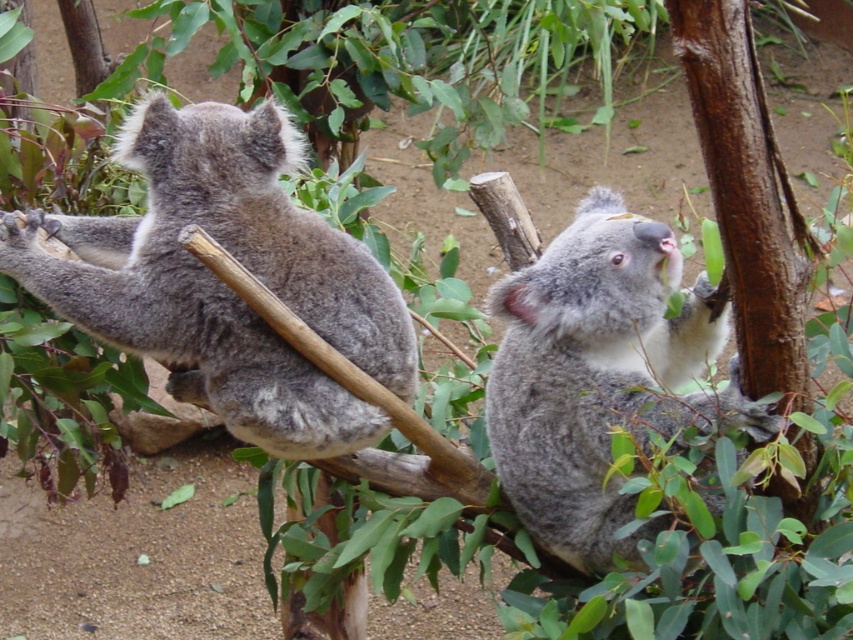
Who is positioned more to the right, gray furry koala at left or fuzzy gray koala at upper right?

fuzzy gray koala at upper right is more to the right.

Which is below, gray furry koala at left or fuzzy gray koala at upper right?

fuzzy gray koala at upper right is below.

Where is `gray furry koala at left`? gray furry koala at left is located at coordinates (224, 284).

I want to click on gray furry koala at left, so click(224, 284).